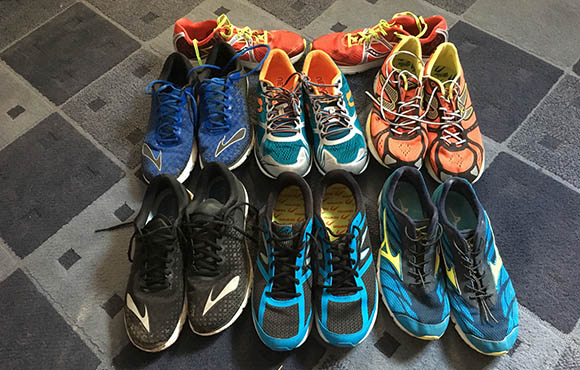
Identify the location of dark grey carpet tole. (85, 51), (65, 172), (28, 325), (536, 267), (505, 88), (230, 354).